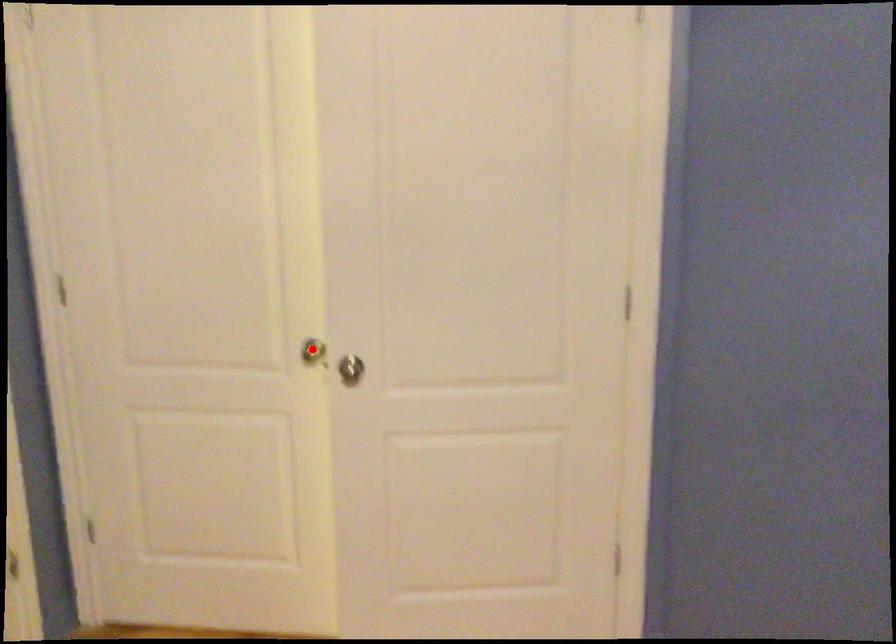
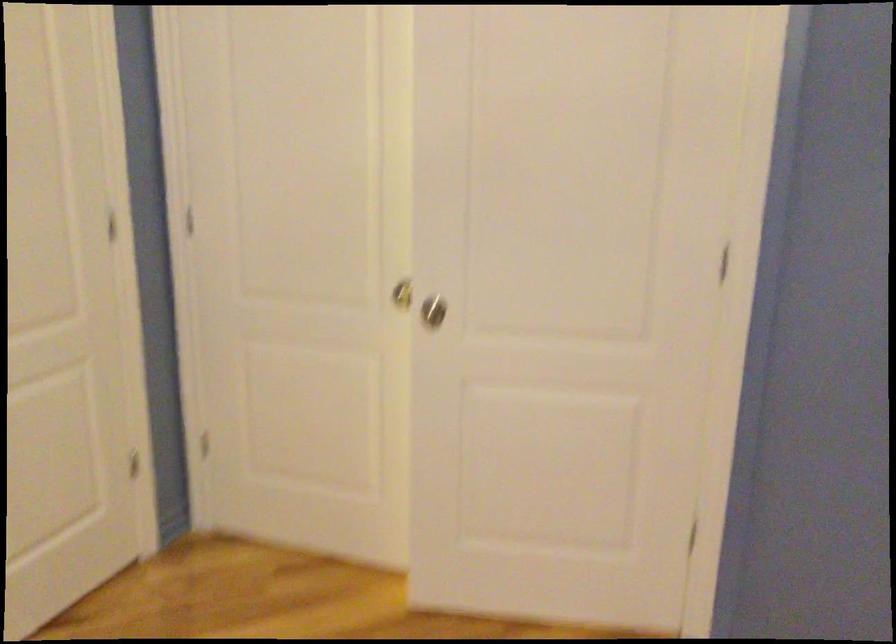
Question: I am providing you with two images of the same scene from different viewpoints. A red point is marked on the first image. At the location where the point appears in image 1, is it still visible in image 2?

Choices:
 (A) Yes
 (B) No

Answer: (A)